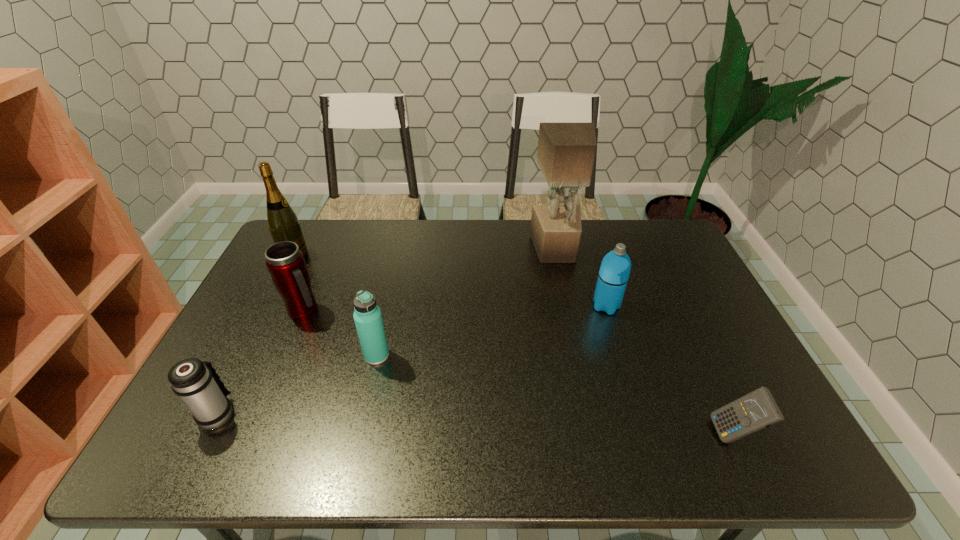
Identify the location of vacant space in between the sixth tallest object and the second nearest thermos bottle. Image resolution: width=960 pixels, height=540 pixels. (298, 384).

Where is `free area in between the sculpture and the second tallest object`? The height and width of the screenshot is (540, 960). free area in between the sculpture and the second tallest object is located at coordinates point(425,252).

What are the coordinates of `empty space between the rightmost thermos bottle and the fifth farthest object` in the screenshot? It's located at (492, 331).

Identify the location of vacant space in between the calculator and the third object from left to right. (518, 373).

The width and height of the screenshot is (960, 540). What are the coordinates of `vacant region between the second nearest thermos bottle and the sculpture` in the screenshot? It's located at (466, 302).

Identify which object is located as the fourth nearest to the rightmost thermos bottle. Please provide its 2D coordinates. Your answer should be formatted as a tuple, i.e. [(x, y)], where the tuple contains the x and y coordinates of a point satisfying the conditions above.

[(285, 262)]

Locate which object is the closest to the sculpture. Please provide its 2D coordinates. Your answer should be formatted as a tuple, i.e. [(x, y)], where the tuple contains the x and y coordinates of a point satisfying the conditions above.

[(615, 268)]

Locate which thermos bottle ranks second in proximity to the rightmost thermos bottle. Please provide its 2D coordinates. Your answer should be formatted as a tuple, i.e. [(x, y)], where the tuple contains the x and y coordinates of a point satisfying the conditions above.

[(285, 262)]

Find the location of a particular element. thermos bottle that is the fourth closest to the shortest object is located at coordinates (199, 386).

The height and width of the screenshot is (540, 960). I want to click on free space that satisfies the following two spatial constraints: 1. on the front side of the rightmost thermos bottle; 2. on the side with the handle of the fifth object from right to left, so click(x=608, y=312).